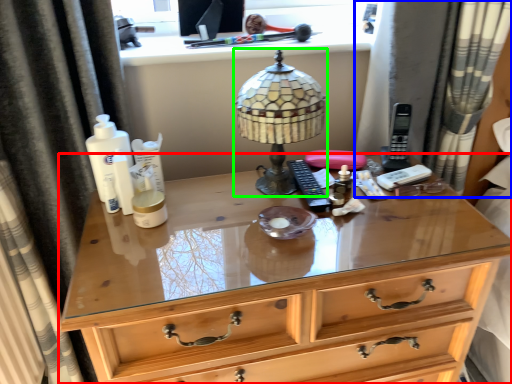
Question: Considering the real-world distances, which object is closest to chest of drawers (highlighted by a red box)? curtain (highlighted by a blue box) or lamp (highlighted by a green box).

Choices:
 (A) curtain
 (B) lamp

Answer: (B)